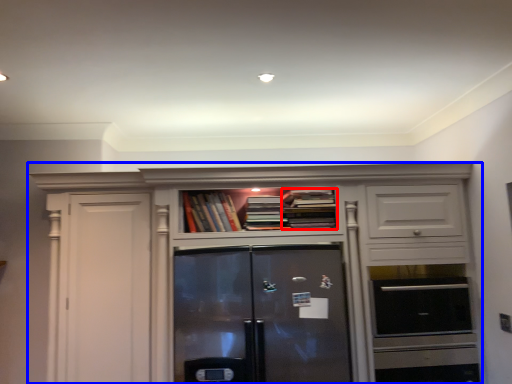
Question: Which object is further to the camera taking this photo, book (highlighted by a red box) or cabinetry (highlighted by a blue box)?

Choices:
 (A) book
 (B) cabinetry

Answer: (A)